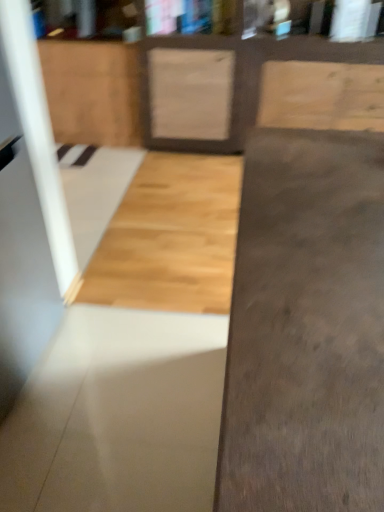
Question: Is gray concrete at center, the 1th concrete from the front, smaller than smooth concrete at center, the first concrete in the back-to-front sequence?

Choices:
 (A) no
 (B) yes

Answer: (A)

Question: Is gray concrete at center, acting as the second concrete starting from the back, located outside smooth concrete at center, the first concrete in the back-to-front sequence?

Choices:
 (A) no
 (B) yes

Answer: (B)

Question: Does gray concrete at center, acting as the second concrete starting from the back, have a greater height compared to smooth concrete at center, the second concrete in the front-to-back sequence?

Choices:
 (A) no
 (B) yes

Answer: (B)

Question: Can you confirm if gray concrete at center, the 1th concrete from the front, is bigger than smooth concrete at center, the first concrete in the back-to-front sequence?

Choices:
 (A) no
 (B) yes

Answer: (B)

Question: From a real-world perspective, is gray concrete at center, acting as the second concrete starting from the back, physically below smooth concrete at center, the first concrete in the back-to-front sequence?

Choices:
 (A) yes
 (B) no

Answer: (B)

Question: Is gray concrete at center, acting as the second concrete starting from the back, at the left side of smooth concrete at center, the first concrete in the back-to-front sequence?

Choices:
 (A) yes
 (B) no

Answer: (B)

Question: Is smooth concrete at center, the first concrete in the back-to-front sequence, taller than natural wood cabinet at upper left?

Choices:
 (A) no
 (B) yes

Answer: (A)

Question: Is smooth concrete at center, the first concrete in the back-to-front sequence, at the left side of natural wood cabinet at upper left?

Choices:
 (A) yes
 (B) no

Answer: (B)

Question: Is smooth concrete at center, the first concrete in the back-to-front sequence, facing away from natural wood cabinet at upper left?

Choices:
 (A) yes
 (B) no

Answer: (B)

Question: From a real-world perspective, is smooth concrete at center, the second concrete in the front-to-back sequence, on top of natural wood cabinet at upper left?

Choices:
 (A) yes
 (B) no

Answer: (B)

Question: From the image's perspective, is smooth concrete at center, the first concrete in the back-to-front sequence, above natural wood cabinet at upper left?

Choices:
 (A) no
 (B) yes

Answer: (A)

Question: Would you say smooth concrete at center, the first concrete in the back-to-front sequence, contains natural wood cabinet at upper left?

Choices:
 (A) yes
 (B) no

Answer: (B)

Question: From the image's perspective, is gray concrete at center, acting as the second concrete starting from the back, located beneath natural wood cabinet at upper left?

Choices:
 (A) no
 (B) yes

Answer: (B)